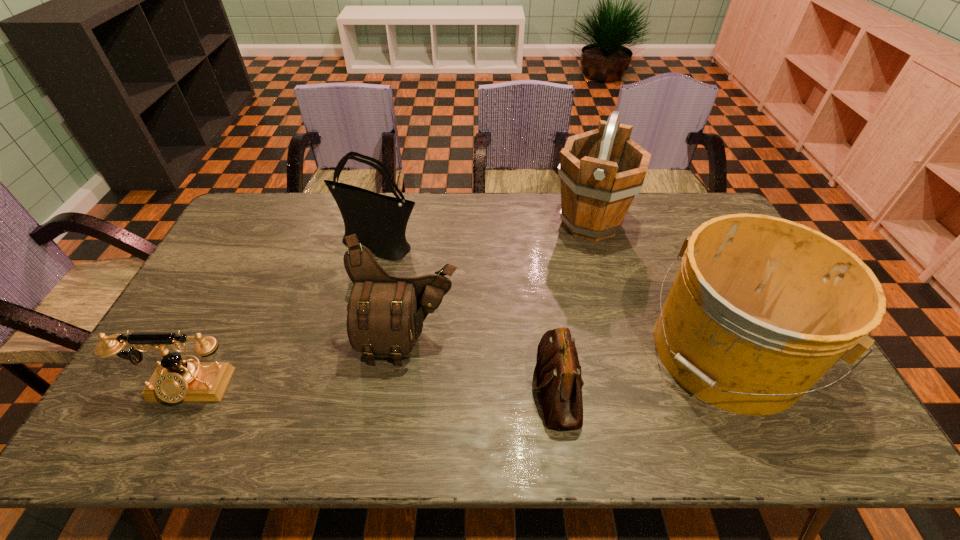
The width and height of the screenshot is (960, 540). In order to click on the second closest shoulder bag to the nearer bucket in this screenshot , I will do `click(385, 316)`.

The image size is (960, 540). What are the coordinates of `vacant space that satisfies the following two spatial constraints: 1. on the back side of the shortest shoulder bag; 2. on the left side of the shorter bucket` in the screenshot? It's located at (552, 352).

Image resolution: width=960 pixels, height=540 pixels. I want to click on free space that satisfies the following two spatial constraints: 1. on the back side of the farthest shoulder bag; 2. on the left side of the taller bucket, so click(384, 223).